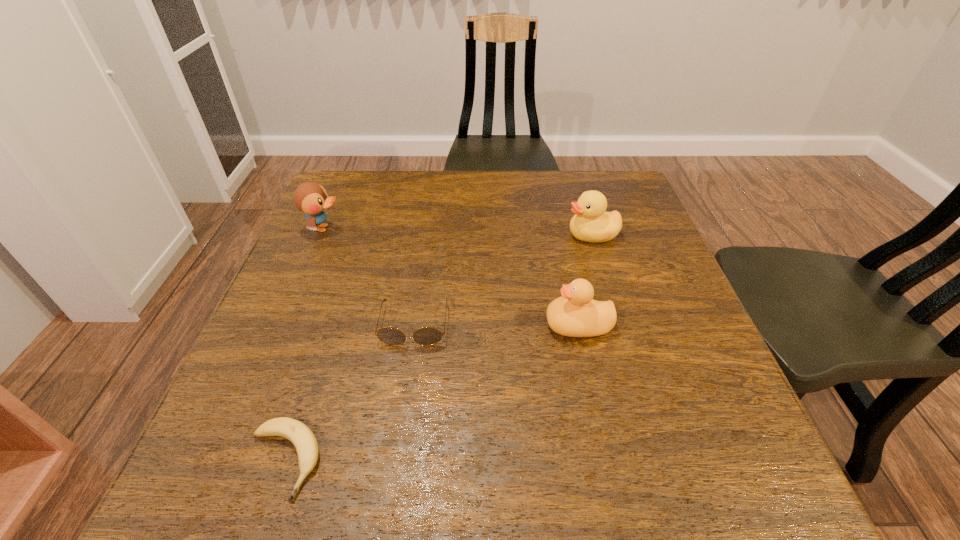
Where is `vacant space at the far left corner`? This screenshot has width=960, height=540. vacant space at the far left corner is located at coordinates point(356,173).

In the image, there is a desktop. What are the coordinates of `vacant space at the near left corner` in the screenshot? It's located at (243, 468).

Image resolution: width=960 pixels, height=540 pixels. In order to click on empty space between the leftmost duck and the nearest duck in this screenshot , I will do `click(451, 276)`.

You are a GUI agent. You are given a task and a screenshot of the screen. Output one action in this format:
    pyautogui.click(x=<x>, y=<y>)
    Task: Click on the free space between the nearest duck and the nearest object
    This screenshot has width=960, height=540.
    Given the screenshot: What is the action you would take?
    pyautogui.click(x=431, y=393)

Locate an element on the screen. The image size is (960, 540). unoccupied area between the fourth tallest object and the nearest duck is located at coordinates (496, 325).

At what (x,y) coordinates should I click in order to perform the action: click on vacant area between the nearest duck and the leftmost duck. Please return your answer as a coordinate pair (x, y). Looking at the image, I should click on (451, 276).

The width and height of the screenshot is (960, 540). In order to click on free spot between the third object from left to right and the nearest duck in this screenshot , I will do 496,325.

At what (x,y) coordinates should I click in order to perform the action: click on vacant area between the banana and the nearest duck. Please return your answer as a coordinate pair (x, y). Image resolution: width=960 pixels, height=540 pixels. Looking at the image, I should click on (431, 393).

This screenshot has height=540, width=960. Identify the location of vacant area that lies between the leftmost duck and the second shortest object. (369, 276).

Find the location of a particular element. free area in between the shortest object and the nearest duck is located at coordinates (431, 393).